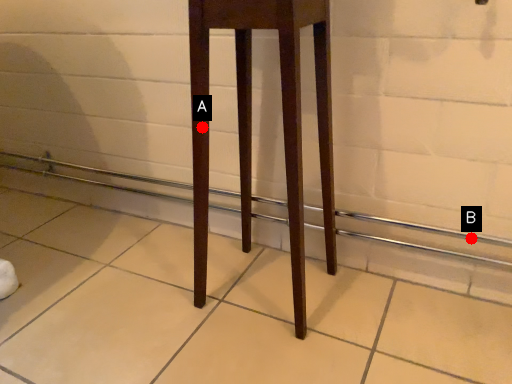
Question: Two points are circled on the image, labeled by A and B beside each circle. Among these points, which one is farthest from the camera?

Choices:
 (A) A is further
 (B) B is further

Answer: (B)